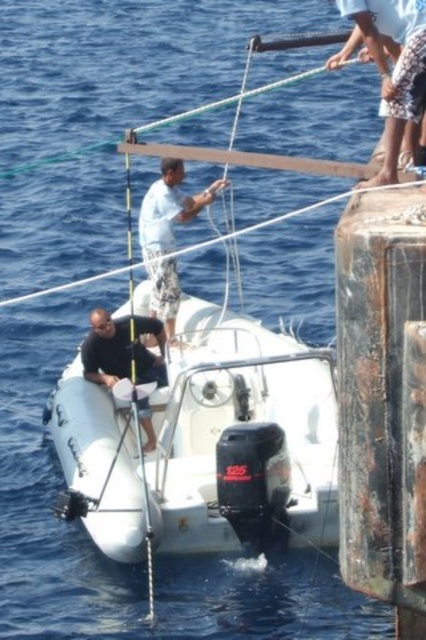
Question: Which of the following is the closest to the observer?

Choices:
 (A) (386, 116)
 (B) (132, 317)
 (C) (218, 184)
 (D) (319, 442)

Answer: (A)

Question: Is white rubber dinghy at center positioned at the back of white woven rope at upper right?

Choices:
 (A) yes
 (B) no

Answer: (A)

Question: Which object is positioned farthest from the white woven rope at upper right?

Choices:
 (A) black matte life jacket at lower left
 (B) white rubber dinghy at center

Answer: (B)

Question: Can you confirm if white woven rope at upper right is bigger than black matte life jacket at lower left?

Choices:
 (A) yes
 (B) no

Answer: (A)

Question: Is white cotton shirt at center thinner than black matte life jacket at lower left?

Choices:
 (A) yes
 (B) no

Answer: (B)

Question: Which object is positioned closest to the black matte life jacket at lower left?

Choices:
 (A) white rubber dinghy at center
 (B) white cotton shirt at center
 (C) white woven rope at upper right

Answer: (B)